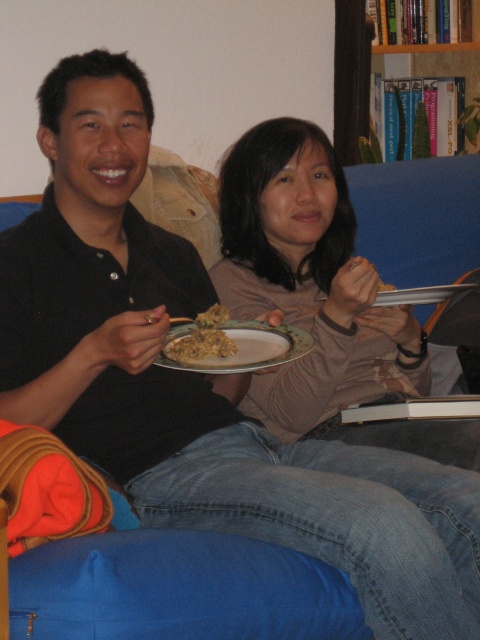
You are a dinner guest at a cozy living room and see two plates on the couch between the two people. Which plate is wider, the matte ceramic plate at center or the brown matte plate at center?

The matte ceramic plate at center is wider than the brown matte plate at center.

You are standing in a room where two people are sitting on a blue cushioned couch. You notice a point at coordinates (320, 298). What object is located at that point?

The object at point (320, 298) is the matte pink sweater at center.